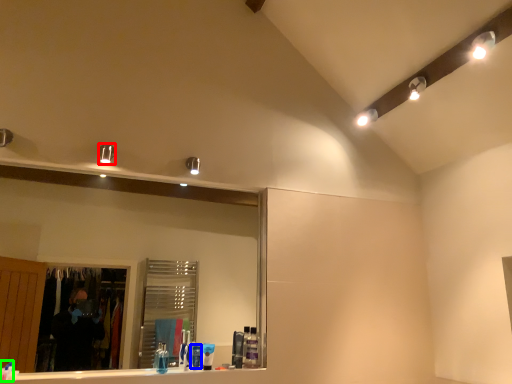
Question: Estimate the real-world distances between objects in this image. Which object is closer to light fixture (highlighted by a red box), toiletry (highlighted by a blue box) or toothpaste (highlighted by a green box)?

Choices:
 (A) toiletry
 (B) toothpaste

Answer: (A)